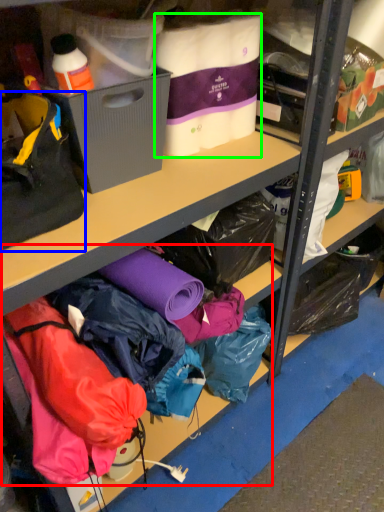
Question: Estimate the real-world distances between objects in this image. Which object is closer to clothing (highlighted by a red box), handbag (highlighted by a blue box) or clothing (highlighted by a green box)?

Choices:
 (A) handbag
 (B) clothing

Answer: (A)